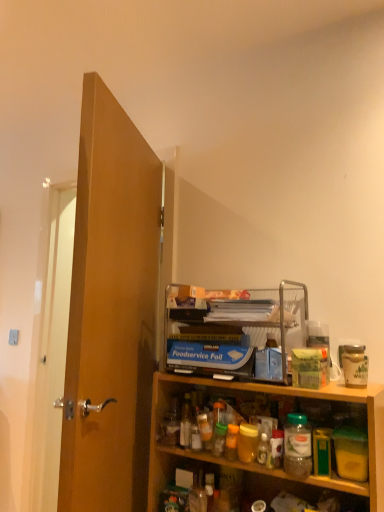
Describe the element at coordinates (111, 310) in the screenshot. I see `wooden door at left` at that location.

Where is `wooden cabinet at lower right`? wooden cabinet at lower right is located at coordinates (257, 426).

I want to click on cabinetry below the blue cardboard foodservice foil at upper center (from the image's perspective), so click(257, 426).

In the image, is blue cardboard foodservice foil at upper center positioned in front of or behind wooden cabinet at lower right?

Visually, blue cardboard foodservice foil at upper center is located behind wooden cabinet at lower right.

From the image's perspective, which is below, blue cardboard foodservice foil at upper center or wooden cabinet at lower right?

wooden cabinet at lower right is shown below in the image.

From a real-world perspective, which is physically below, blue cardboard foodservice foil at upper center or wooden cabinet at lower right?

From a 3D spatial view, wooden cabinet at lower right is below.

From the image's perspective, does wooden door at left appear lower than wooden cabinet at lower right?

No, from the image's perspective, wooden door at left is not beneath wooden cabinet at lower right.

From a real-world perspective, who is located lower, wooden door at left or wooden cabinet at lower right?

From a 3D spatial view, wooden cabinet at lower right is below.

Could you tell me if blue cardboard foodservice foil at upper center is turned towards wooden door at left?

No, blue cardboard foodservice foil at upper center does not turn towards wooden door at left.

Considering the positions of objects blue cardboard foodservice foil at upper center and wooden door at left in the image provided, who is more to the left, blue cardboard foodservice foil at upper center or wooden door at left?

wooden door at left.

Looking at this image, which object is further away from the camera taking this photo, blue cardboard foodservice foil at upper center or wooden door at left?

blue cardboard foodservice foil at upper center is behind.

Is point (120, 148) more distant than point (216, 357)?

Yes, point (120, 148) is farther from viewer.

What's the angular difference between wooden door at left and blue cardboard foodservice foil at upper center's facing directions?

69.9 degrees separate the facing orientations of wooden door at left and blue cardboard foodservice foil at upper center.

From the image's perspective, is wooden door at left positioned above or below blue cardboard foodservice foil at upper center?

Based on their image positions, wooden door at left is located above blue cardboard foodservice foil at upper center.

Which is more to the right, wooden door at left or blue cardboard foodservice foil at upper center?

blue cardboard foodservice foil at upper center.

How many degrees apart are the facing directions of wooden cabinet at lower right and wooden door at left?

69.7 degrees.

Could wooden door at left be considered to be inside wooden cabinet at lower right?

No.

Is wooden cabinet at lower right facing away from wooden door at left?

That's not correct — wooden cabinet at lower right is not looking away from wooden door at left.

Looking at this image, which object is positioned more to the right, wooden cabinet at lower right or wooden door at left?

Positioned to the right is wooden cabinet at lower right.

From their relative heights in the image, would you say wooden cabinet at lower right is taller or shorter than blue cardboard foodservice foil at upper center?

Clearly, wooden cabinet at lower right is taller compared to blue cardboard foodservice foil at upper center.

Is the surface of wooden cabinet at lower right in direct contact with blue cardboard foodservice foil at upper center?

No, wooden cabinet at lower right is not in contact with blue cardboard foodservice foil at upper center.

Is blue cardboard foodservice foil at upper center surrounded by wooden cabinet at lower right?

Definitely not — blue cardboard foodservice foil at upper center is not inside wooden cabinet at lower right.

Between wooden cabinet at lower right and blue cardboard foodservice foil at upper center, which one has larger width?

Wider between the two is blue cardboard foodservice foil at upper center.

The height and width of the screenshot is (512, 384). I want to click on cabinetry on the right of blue cardboard foodservice foil at upper center, so click(257, 426).

You are a GUI agent. You are given a task and a screenshot of the screen. Output one action in this format:
    pyautogui.click(x=<x>, y=<y>)
    Task: Click on the door on the left of wooden cabinet at lower right
    The height and width of the screenshot is (512, 384).
    Given the screenshot: What is the action you would take?
    pyautogui.click(x=111, y=310)

Based on their spatial positions, is wooden door at left or wooden cabinet at lower right closer to blue cardboard foodservice foil at upper center?

The object closer to blue cardboard foodservice foil at upper center is wooden cabinet at lower right.

Based on their spatial positions, is blue cardboard foodservice foil at upper center or wooden cabinet at lower right further from wooden door at left?

wooden cabinet at lower right is positioned further to the anchor wooden door at left.

From the image, which object appears to be nearer to blue cardboard foodservice foil at upper center, wooden cabinet at lower right or wooden door at left?

The object closer to blue cardboard foodservice foil at upper center is wooden cabinet at lower right.

From the image, which object appears to be nearer to wooden cabinet at lower right, blue cardboard foodservice foil at upper center or wooden door at left?

blue cardboard foodservice foil at upper center is closer to wooden cabinet at lower right.

When comparing their distances from wooden door at left, does wooden cabinet at lower right or blue cardboard foodservice foil at upper center seem further?

wooden cabinet at lower right lies further to wooden door at left than the other object.

Which object lies nearer to the anchor point wooden cabinet at lower right, wooden door at left or blue cardboard foodservice foil at upper center?

Based on the image, blue cardboard foodservice foil at upper center appears to be nearer to wooden cabinet at lower right.

Find the location of a particular element. This screenshot has height=512, width=384. shelf between wooden door at left and wooden cabinet at lower right from left to right is located at coordinates (234, 329).